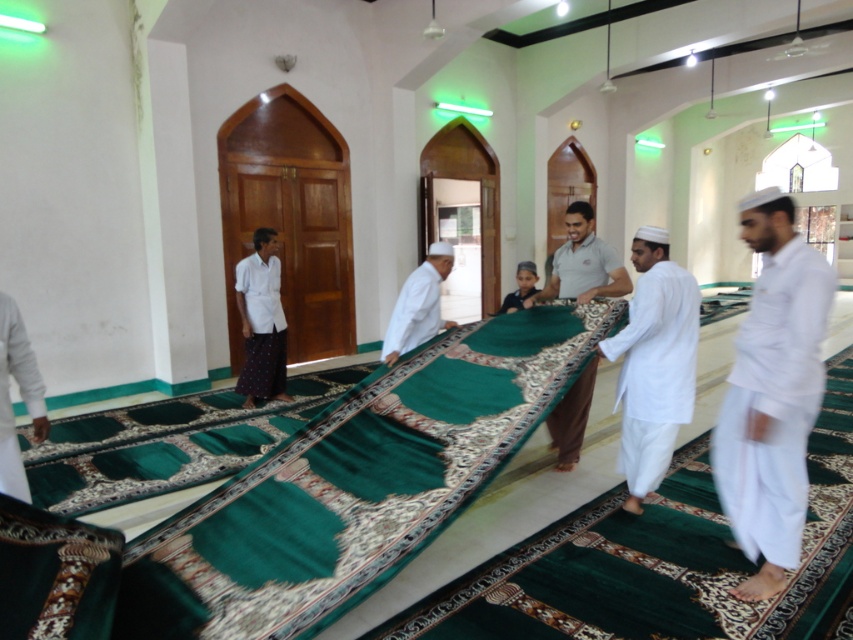
Who is positioned more to the right, white cotton shirt at center or dark green fabric at center?

From the viewer's perspective, white cotton shirt at center appears more on the right side.

Is white cotton shirt at center behind dark green fabric at center?

No, white cotton shirt at center is closer to the viewer.

Measure the distance between white cotton shirt at center and camera.

The distance of white cotton shirt at center from camera is 12.43 feet.

Find the location of a particular element. white cotton shirt at center is located at coordinates (x=583, y=262).

Is the position of white matte robe at lower left more distant than that of white matte prayer mat at center?

No.

Measure the distance between white matte robe at lower left and camera.

They are 8.74 feet apart.

The image size is (853, 640). Find the location of `white matte robe at lower left`. white matte robe at lower left is located at coordinates (20, 396).

Is point (277, 301) behind point (24, 496)?

Yes, point (277, 301) is behind point (24, 496).

Who is higher up, white cotton robe at center or white matte robe at lower left?

white cotton robe at center is above.

Does point (271, 324) come closer to viewer compared to point (16, 480)?

No, it is behind (16, 480).

Where is `white cotton robe at center`? This screenshot has height=640, width=853. white cotton robe at center is located at coordinates (260, 324).